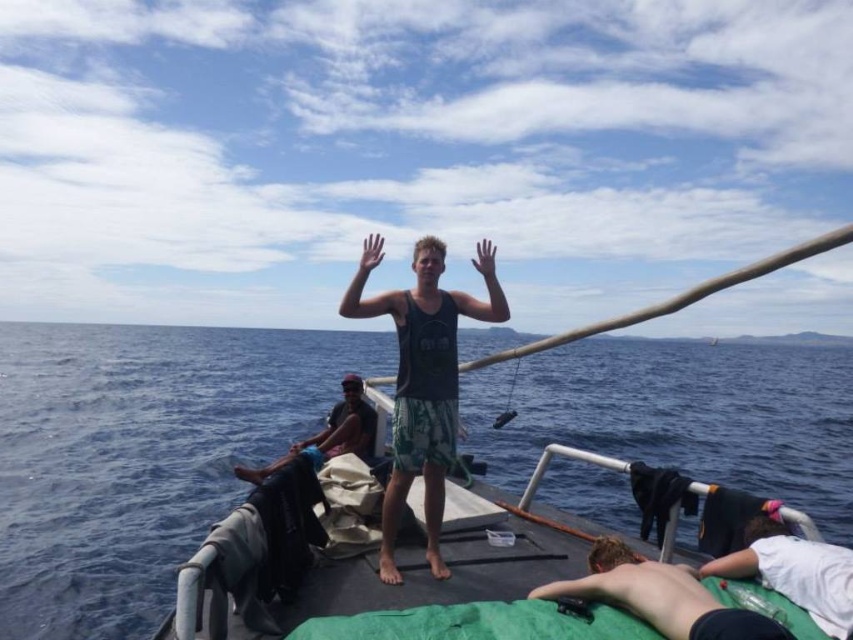
You are a photographer on the boat and want to capture the black matte tank top at center and the dark green fabric at center in a single photo. Based on their positions, which one will appear closer to the top of the photo?

The black matte tank top at center appears closer to the top of the photo because it is above the dark green fabric at center.

You are a sailor on the boat and need to reach the shiny skin at lower right from the dark green fabric at center. Can you walk directly to it without stepping over anything?

The shiny skin at lower right is 10.55 feet away from the dark green fabric at center. Since there are no obstacles mentioned between them, you can walk directly to it without stepping over anything.

You are a photographer on the boat and want to capture a photo of both the shiny skin at lower right and the white cotton shirt at lower right. Which object should be placed closer to the camera to ensure both are in focus?

The shiny skin at lower right has a lesser height compared to the white cotton shirt at lower right. To ensure both are in focus, the photographer should place the shiny skin at lower right closer to the camera since it is shorter than the white cotton shirt at lower right.